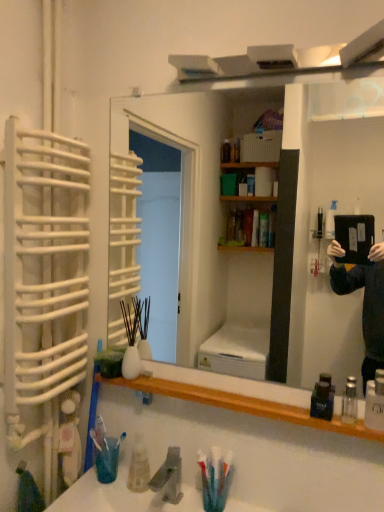
At what (x,y) coordinates should I click in order to perform the action: click on vacant region to the left of dark blue plastic mouthwash at lower right, the 2th mouthwash in the right-to-left sequence. Please return your answer as a coordinate pair (x, y). Image resolution: width=384 pixels, height=512 pixels. Looking at the image, I should click on (271, 405).